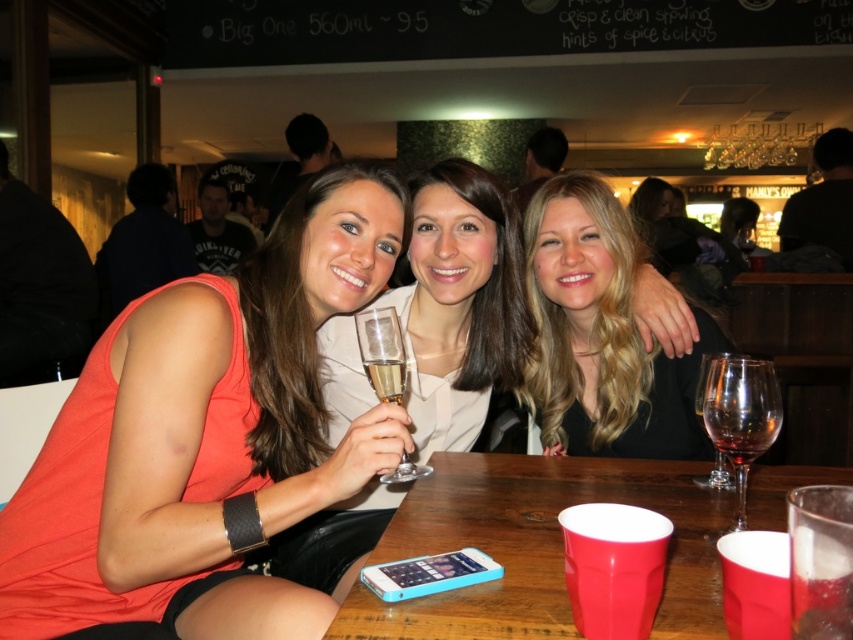
You are a photographer trying to capture a candid shot of the blonde hair at center without including the wooden table at center in the frame. Is this possible given their current positions?

The wooden table at center is positioned under blonde hair at center, so it would be difficult to capture the blonde hair at center without including the wooden table at center in the frame.

You are a photographer standing in front of the wooden table at center and the blonde hair at center. You want to take a photo of both subjects. Which one will you need to adjust your camera angle upwards to capture properly?

The blonde hair at center is taller than the wooden table at center, so you will need to adjust your camera angle upwards to capture the blonde hair at center properly.

You are standing in the bar and want to take a photo of the group. The camera has a zoom lens that can focus on objects within a 0.5 meter radius. The coordinates of the camera are at point 0.5 meters from the center of the image. Can you capture the blonde hair at center in your photo?

The position of blonde hair at center is at point (x=601, y=333). The camera is positioned at 0.5 meters from the center of the image. The distance between the camera and the blonde hair at center needs to be calculated to determine if it falls within the 0.5 meter radius. However, without knowing the exact coordinate system scale or the direction of the camera placement, it is impossible to accurately determine if the blonde hair at center is within the camera range. Additional information about the image or